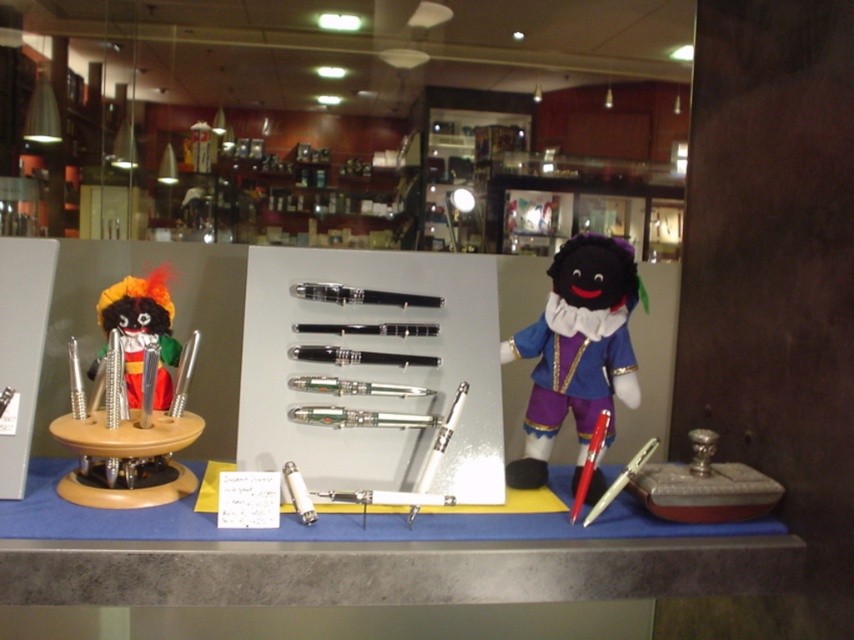
Does point (357, 561) come farther from viewer compared to point (325, 285)?

No.

Can you confirm if blue fabric table at center is positioned below black glossy pen at center?

Yes.

This screenshot has height=640, width=854. I want to click on blue fabric table at center, so click(401, 572).

In order to click on blue fabric table at center in this screenshot , I will do `click(401, 572)`.

Between wooden toy at left and black glossy pen at center, which one appears on the right side from the viewer's perspective?

black glossy pen at center is more to the right.

Between wooden toy at left and black glossy pen at center, which one is positioned lower?

wooden toy at left

This screenshot has width=854, height=640. What are the coordinates of `wooden toy at left` in the screenshot? It's located at (133, 403).

Between wooden toy at left and velvet doll at center, which one has less height?

With less height is wooden toy at left.

Between wooden toy at left and velvet doll at center, which one is positioned lower?

Positioned lower is velvet doll at center.

You are a GUI agent. You are given a task and a screenshot of the screen. Output one action in this format:
    pyautogui.click(x=<x>, y=<y>)
    Task: Click on the wooden toy at left
    This screenshot has width=854, height=640.
    Given the screenshot: What is the action you would take?
    pyautogui.click(x=133, y=403)